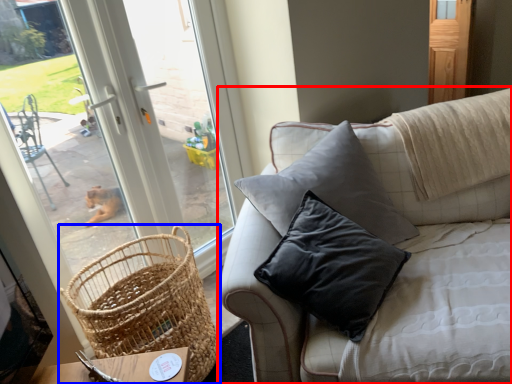
Question: Which of the following is the farthest to the observer, studio couch (highlighted by a red box) or picnic basket (highlighted by a blue box)?

Choices:
 (A) studio couch
 (B) picnic basket

Answer: (B)